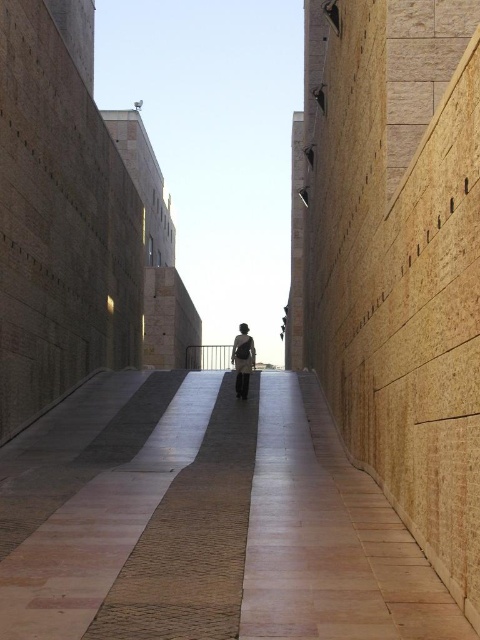
You are standing at the entrance of the passageway and notice the polished stone pavement at center and the white fabric dress at center. Which object is wider?

The polished stone pavement at center is wider than the white fabric dress at center.

You are standing at the entrance of the passageway and see two points marked on the ground. The first point is at location point (x=317, y=608) and the second is at point (x=235, y=340). If you want to reach the point that is closer to you, which one should you walk towards?

You should walk towards point (x=317, y=608) because it is closer to the camera than point (x=235, y=340).